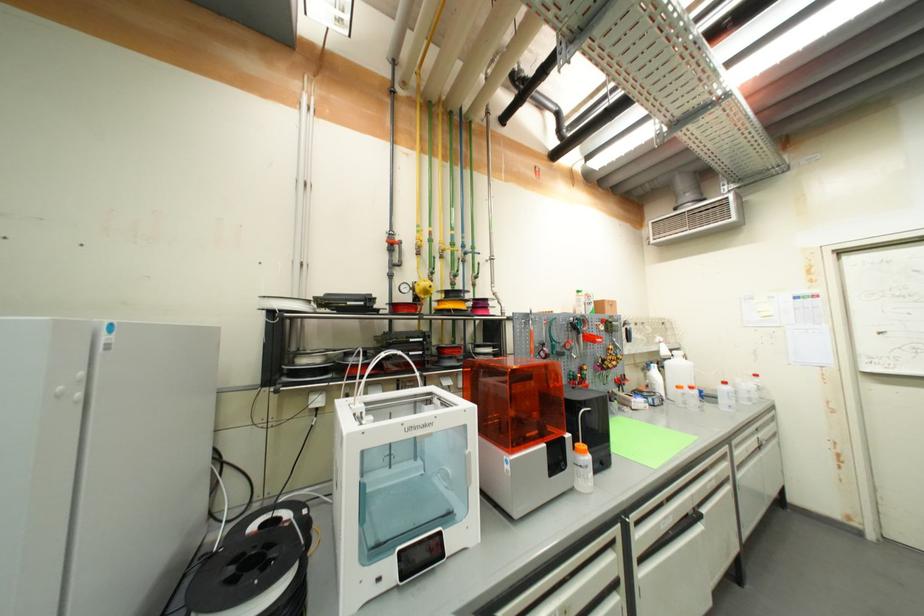
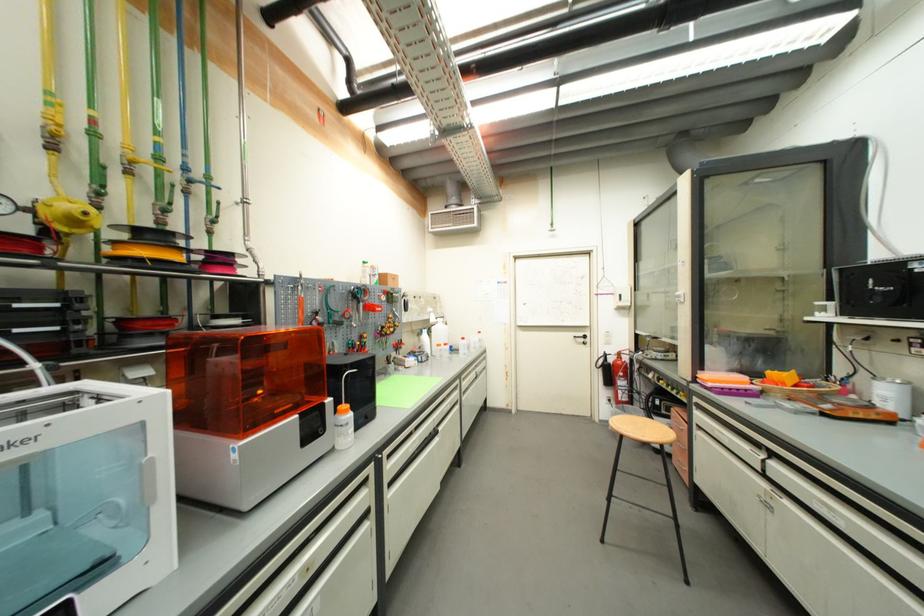
Where in the second image is the point corresponding to (500,387) from the first image?

(237, 363)